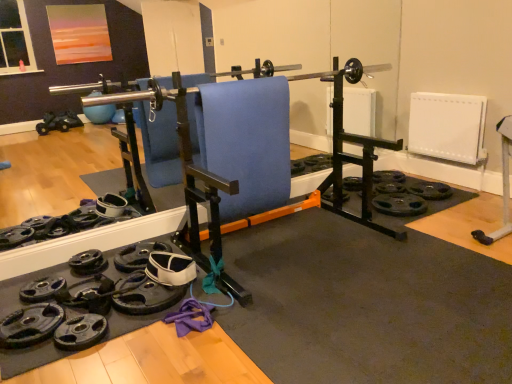
Question: Is black rubber weight plate at lower left, which is the first wheel in left-to-right order, oriented away from black rubber weight plate at lower left, the second wheel viewed from the left?

Choices:
 (A) yes
 (B) no

Answer: (A)

Question: Does black rubber weight plate at lower left, which is counted as the 3th wheel, starting from the back, turn towards black rubber weight plate at lower left, which is counted as the second wheel, starting from the right?

Choices:
 (A) no
 (B) yes

Answer: (A)

Question: Does black rubber weight plate at lower left, the 1th wheel in the bottom-to-top sequence, appear on the right side of black rubber weight plate at lower left, the second wheel when ordered from top to bottom?

Choices:
 (A) no
 (B) yes

Answer: (A)

Question: From a real-world perspective, is black rubber weight plate at lower left, the third wheel in the top-to-bottom sequence, over black rubber weight plate at lower left, arranged as the second wheel when ordered from the bottom?

Choices:
 (A) yes
 (B) no

Answer: (B)

Question: Is black rubber weight plate at lower left, the third wheel in the top-to-bottom sequence, far from black rubber weight plate at lower left, which is the second wheel from front to back?

Choices:
 (A) yes
 (B) no

Answer: (B)

Question: From a real-world perspective, is blue fabric swivel chair at center above or below black rubber weight plate at lower left, the third wheel in the top-to-bottom sequence?

Choices:
 (A) above
 (B) below

Answer: (A)

Question: Considering the positions of blue fabric swivel chair at center and black rubber weight plate at lower left, the third wheel positioned from the right, in the image, is blue fabric swivel chair at center wider or thinner than black rubber weight plate at lower left, the third wheel positioned from the right,?

Choices:
 (A) wide
 (B) thin

Answer: (B)

Question: Do you think blue fabric swivel chair at center is within black rubber weight plate at lower left, which is counted as the first wheel, starting from the front, or outside of it?

Choices:
 (A) inside
 (B) outside

Answer: (B)

Question: In the image, is blue fabric swivel chair at center on the left side or the right side of black rubber weight plate at lower left, the third wheel positioned from the right?

Choices:
 (A) left
 (B) right

Answer: (B)

Question: Looking at the image, does black rubber weight plate at center, placed as the third wheel when sorted from left to right, seem bigger or smaller compared to blue fabric swivel chair at center?

Choices:
 (A) small
 (B) big

Answer: (A)

Question: Considering the positions of black rubber weight plate at center, placed as the third wheel when sorted from left to right, and blue fabric swivel chair at center in the image, is black rubber weight plate at center, placed as the third wheel when sorted from left to right, wider or thinner than blue fabric swivel chair at center?

Choices:
 (A) wide
 (B) thin

Answer: (A)

Question: Is black rubber weight plate at center, placed as the 3th wheel when sorted from front to back, in front of or behind blue fabric swivel chair at center in the image?

Choices:
 (A) front
 (B) behind

Answer: (B)

Question: Considering the positions of black rubber weight plate at center, acting as the first wheel starting from the right, and blue fabric swivel chair at center in the image, is black rubber weight plate at center, acting as the first wheel starting from the right, taller or shorter than blue fabric swivel chair at center?

Choices:
 (A) tall
 (B) short

Answer: (B)

Question: From the image's perspective, is black rubber weight plate at lower left, the second wheel when ordered from top to bottom, located above or below black rubber weight plate at center, the 1th wheel viewed from the back?

Choices:
 (A) below
 (B) above

Answer: (A)

Question: From their relative heights in the image, would you say black rubber weight plate at lower left, the second wheel viewed from the left, is taller or shorter than black rubber weight plate at center, placed as the third wheel when sorted from left to right?

Choices:
 (A) short
 (B) tall

Answer: (B)